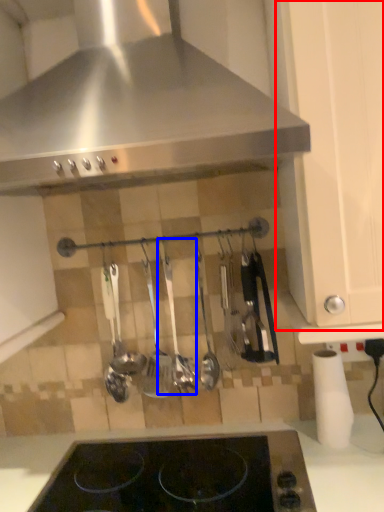
Question: Which object is further to the camera taking this photo, cabinetry (highlighted by a red box) or silverware (highlighted by a blue box)?

Choices:
 (A) cabinetry
 (B) silverware

Answer: (B)